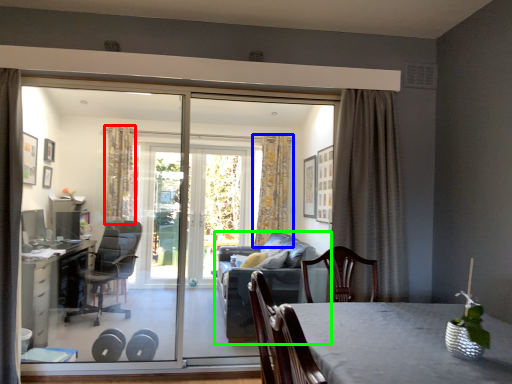
Question: Considering the real-world distances, which object is farthest from curtain (highlighted by a red box)? curtain (highlighted by a blue box) or studio couch (highlighted by a green box)?

Choices:
 (A) curtain
 (B) studio couch

Answer: (B)